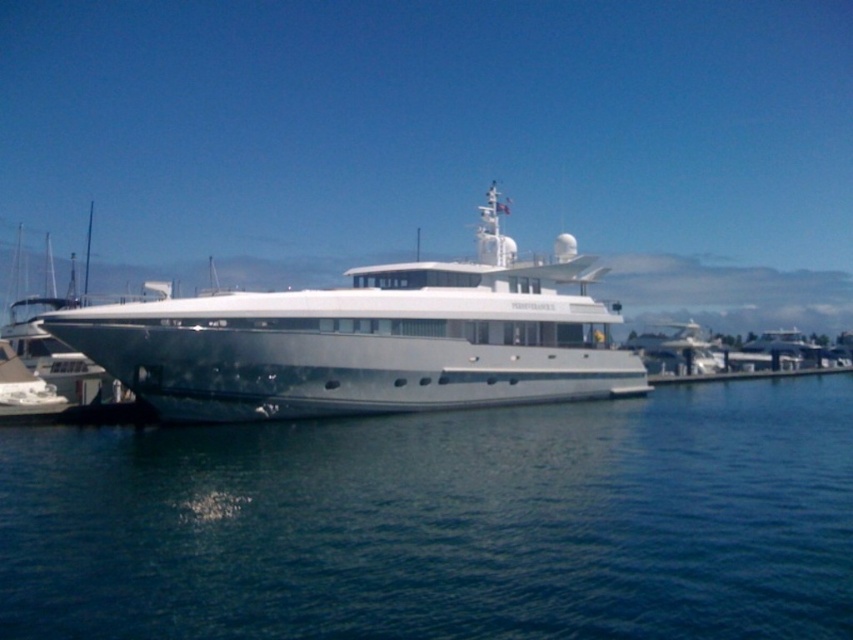
You are a photographer planning to capture the white glossy cruise ship at center and the blue water at center from a nearby dock. Based on the scene, which object would appear taller in your photo?

The white glossy cruise ship at center appears taller than the blue water at center in the photo because the blue water at center is not as tall as the white glossy cruise ship at center.

You are standing on the deck of the yacht and want to locate the blue water at center. According to the coordinates provided, where would you find it?

The blue water at center is located at coordinates point (444,524).

You are standing on the dock and looking out at the blue water at center and the white glossy cruise ship at center. Which object appears closer to you?

The blue water at center is in front of the white glossy cruise ship at center, so it appears closer to you.